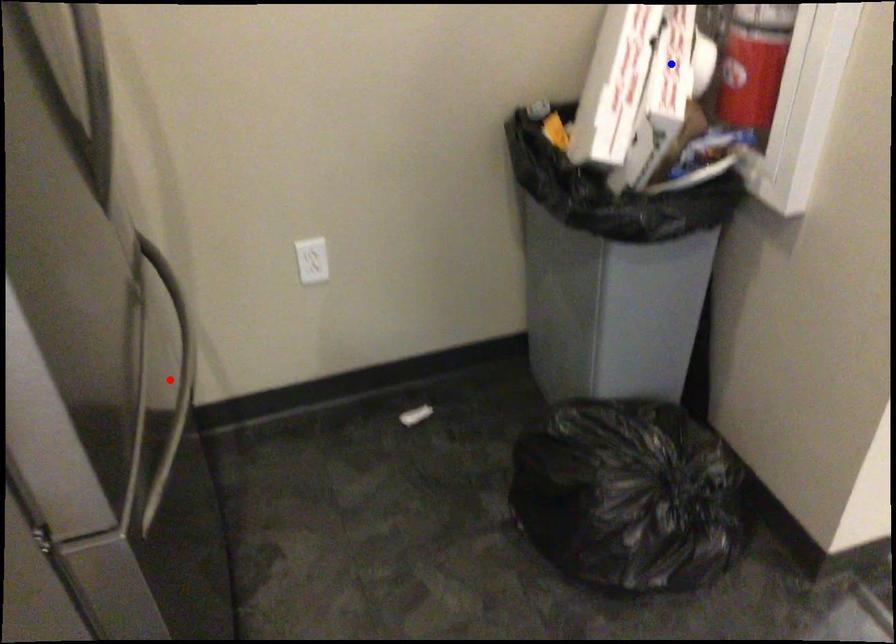
Question: In the image, two points are highlighted. Which point is nearer to the camera? Reply with the corresponding letter.

Choices:
 (A) blue point
 (B) red point

Answer: (A)